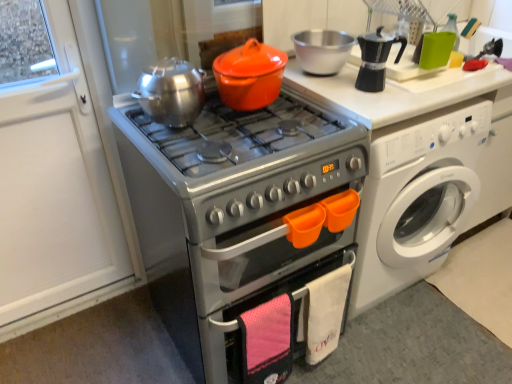
Measure the distance between point [154,69] and camera.

Point [154,69] and camera are 1.43 meters apart.

The width and height of the screenshot is (512, 384). What do you see at coordinates (249, 75) in the screenshot?
I see `orange matte crock pot at center` at bounding box center [249, 75].

The image size is (512, 384). What do you see at coordinates (416, 198) in the screenshot?
I see `white glossy washing machine at right` at bounding box center [416, 198].

Identify the location of brushed metal tea pot at upper center. Image resolution: width=512 pixels, height=384 pixels. (170, 92).

The image size is (512, 384). In order to click on oven below the brushed metal tea pot at upper center (from a real-world perspective) in this screenshot , I will do `click(241, 218)`.

From the image's perspective, would you say brushed metal tea pot at upper center is positioned over silver metallic oven at center?

Yes.

Are brushed metal tea pot at upper center and silver metallic oven at center located far from each other?

No, there isn't a large distance between brushed metal tea pot at upper center and silver metallic oven at center.

Which is behind, point (163, 89) or point (297, 159)?

Positioned behind is point (163, 89).

Which object is positioned more to the left, white glossy washing machine at right or silver metallic oven at center?

From the viewer's perspective, silver metallic oven at center appears more on the left side.

Could you tell me if white glossy washing machine at right is facing silver metallic oven at center?

No, white glossy washing machine at right is not facing towards silver metallic oven at center.

Is white glossy washing machine at right further to the viewer compared to silver metallic oven at center?

That is True.

From the image's perspective, is white glossy washing machine at right on top of silver metallic oven at center?

Indeed, from the image's perspective, white glossy washing machine at right is shown above silver metallic oven at center.

At what (x,y) coordinates should I click in order to perform the action: click on washing machine lying on the right of silver metallic oven at center. Please return your answer as a coordinate pair (x, y). The height and width of the screenshot is (384, 512). Looking at the image, I should click on (416, 198).

Between point (212, 331) and point (408, 131), which one is positioned behind?

The point (408, 131) is farther.

Which of these two, silver metallic oven at center or white glossy washing machine at right, is wider?

Wider between the two is white glossy washing machine at right.

From a real-world perspective, between silver metallic oven at center and white glossy washing machine at right, who is vertically lower?

From a 3D spatial view, white glossy washing machine at right is below.

Who is more distant, white glossy washing machine at right or orange matte crock pot at center?

white glossy washing machine at right is behind.

Considering the sizes of objects white glossy washing machine at right and orange matte crock pot at center in the image provided, who is taller, white glossy washing machine at right or orange matte crock pot at center?

With more height is white glossy washing machine at right.

Is white glossy washing machine at right at the right side of orange matte crock pot at center?

Correct, you'll find white glossy washing machine at right to the right of orange matte crock pot at center.

How many degrees apart are the facing directions of white glossy washing machine at right and orange matte crock pot at center?

The facing directions of white glossy washing machine at right and orange matte crock pot at center are 0.885 degrees apart.

Based on the photo, is silver metallic oven at center next to brushed metal tea pot at upper center and touching it?

There is a gap between silver metallic oven at center and brushed metal tea pot at upper center.

In the scene shown: From a real-world perspective, which is physically above, silver metallic oven at center or brushed metal tea pot at upper center?

brushed metal tea pot at upper center, from a real-world perspective.

Considering the sizes of silver metallic oven at center and brushed metal tea pot at upper center in the image, is silver metallic oven at center taller or shorter than brushed metal tea pot at upper center?

In the image, silver metallic oven at center appears to be taller than brushed metal tea pot at upper center.

Between silver metallic oven at center and brushed metal tea pot at upper center, which one has larger width?

Wider between the two is silver metallic oven at center.

Could you tell me if orange matte crock pot at center is turned towards brushed metal tea pot at upper center?

No, orange matte crock pot at center is not facing towards brushed metal tea pot at upper center.

Identify the location of crock pot located behind the brushed metal tea pot at upper center. This screenshot has width=512, height=384. (249, 75).

From a real-world perspective, is orange matte crock pot at center physically located above or below brushed metal tea pot at upper center?

Clearly, from a real-world perspective, orange matte crock pot at center is above brushed metal tea pot at upper center.

From the image's perspective, is silver metallic oven at center under orange matte crock pot at center?

Yes, from the image's perspective, silver metallic oven at center is below orange matte crock pot at center.

Would you say silver metallic oven at center is inside or outside orange matte crock pot at center?

silver metallic oven at center is located beyond the bounds of orange matte crock pot at center.

Is silver metallic oven at center bigger than orange matte crock pot at center?

Indeed, silver metallic oven at center has a larger size compared to orange matte crock pot at center.

You are a GUI agent. You are given a task and a screenshot of the screen. Output one action in this format:
    pyautogui.click(x=<x>, y=<y>)
    Task: Click on the tea pot above the silver metallic oven at center (from the image's perspective)
    Image resolution: width=512 pixels, height=384 pixels.
    Given the screenshot: What is the action you would take?
    pyautogui.click(x=170, y=92)

The image size is (512, 384). I want to click on oven on the left of the white glossy washing machine at right, so click(x=241, y=218).

Considering their positions, is brushed metal tea pot at upper center positioned further to silver metallic oven at center than white glossy washing machine at right?

Among the two, white glossy washing machine at right is located further to silver metallic oven at center.

When comparing their distances from brushed metal tea pot at upper center, does orange matte crock pot at center or white glossy washing machine at right seem closer?

orange matte crock pot at center lies closer to brushed metal tea pot at upper center than the other object.

Looking at the image, which one is located further to orange matte crock pot at center, white glossy washing machine at right or brushed metal tea pot at upper center?

white glossy washing machine at right is positioned further to the anchor orange matte crock pot at center.

From the image, which object appears to be nearer to brushed metal tea pot at upper center, white glossy washing machine at right or orange matte crock pot at center?

The object closer to brushed metal tea pot at upper center is orange matte crock pot at center.

Which object lies further to the anchor point white glossy washing machine at right, silver metallic oven at center or brushed metal tea pot at upper center?

brushed metal tea pot at upper center.

When comparing their distances from white glossy washing machine at right, does brushed metal tea pot at upper center or silver metallic oven at center seem further?

brushed metal tea pot at upper center is positioned further to the anchor white glossy washing machine at right.

Looking at the image, which one is located further to orange matte crock pot at center, brushed metal tea pot at upper center or white glossy washing machine at right?

white glossy washing machine at right lies further to orange matte crock pot at center than the other object.

From the image, which object appears to be nearer to orange matte crock pot at center, brushed metal tea pot at upper center or silver metallic oven at center?

Among the two, brushed metal tea pot at upper center is located nearer to orange matte crock pot at center.

Where is `crock pot located between brushed metal tea pot at upper center and white glossy washing machine at right in the left-right direction`? This screenshot has height=384, width=512. crock pot located between brushed metal tea pot at upper center and white glossy washing machine at right in the left-right direction is located at coordinates (249, 75).

Where is `oven situated between brushed metal tea pot at upper center and white glossy washing machine at right from left to right`? This screenshot has width=512, height=384. oven situated between brushed metal tea pot at upper center and white glossy washing machine at right from left to right is located at coordinates (x=241, y=218).

Image resolution: width=512 pixels, height=384 pixels. What are the coordinates of `crock pot between silver metallic oven at center and white glossy washing machine at right in the horizontal direction` in the screenshot? It's located at (249, 75).

Where is `tea pot between orange matte crock pot at center and silver metallic oven at center in the vertical direction`? tea pot between orange matte crock pot at center and silver metallic oven at center in the vertical direction is located at coordinates (170, 92).